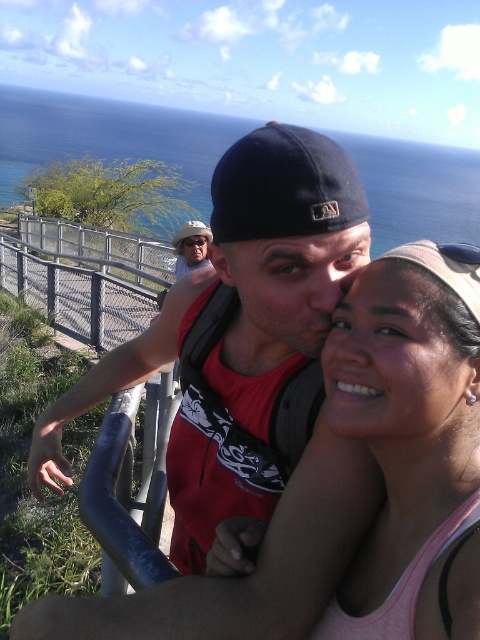
Which is more to the left, pink fabric tank top at center or matte black cap at upper center?

From the viewer's perspective, matte black cap at upper center appears more on the left side.

Where is `pink fabric tank top at center`? Image resolution: width=480 pixels, height=640 pixels. pink fabric tank top at center is located at coordinates (410, 440).

Between point (474, 454) and point (199, 248), which one is positioned behind?

Positioned behind is point (199, 248).

Find the location of `pink fabric tank top at center`. pink fabric tank top at center is located at coordinates (410, 440).

Measure the distance between matte red tank top at center and camera.

matte red tank top at center is 28.94 inches away from camera.

Is matte red tank top at center to the left of matte black cap at upper center from the viewer's perspective?

In fact, matte red tank top at center is to the right of matte black cap at upper center.

Where is `matte red tank top at center`? The width and height of the screenshot is (480, 640). matte red tank top at center is located at coordinates (237, 330).

Locate an element on the screen. Image resolution: width=480 pixels, height=640 pixels. matte red tank top at center is located at coordinates (237, 330).

Between matte red tank top at center and pink fabric tank top at center, which one appears on the left side from the viewer's perspective?

Positioned to the left is matte red tank top at center.

Can you confirm if matte red tank top at center is thinner than pink fabric tank top at center?

Incorrect, matte red tank top at center's width is not less than pink fabric tank top at center's.

Where is `matte red tank top at center`? matte red tank top at center is located at coordinates (237, 330).